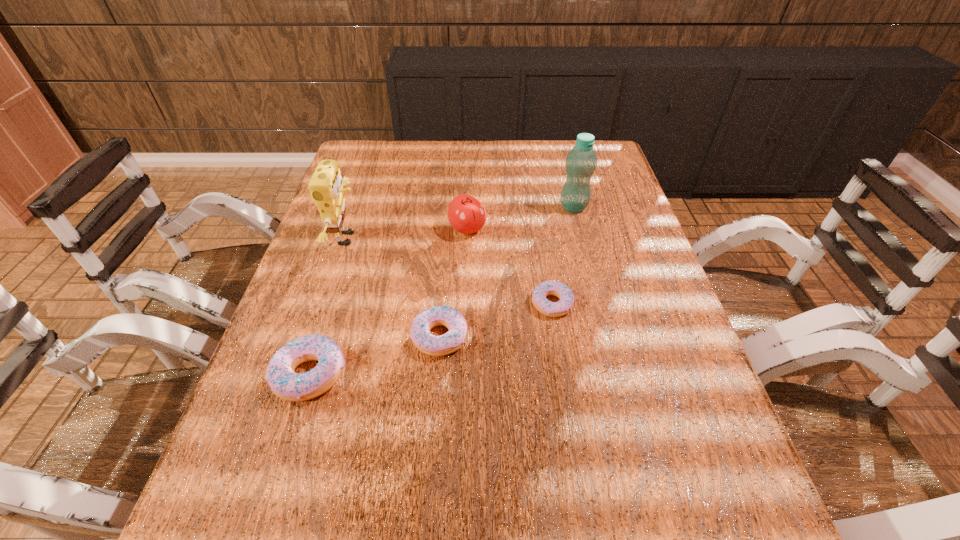
Image resolution: width=960 pixels, height=540 pixels. Identify the location of vacant space situated on the left of the fifth tallest object. (344, 337).

I want to click on free region located 0.300m on the left of the fifth object from left to right, so click(403, 304).

Locate an element on the screen. The width and height of the screenshot is (960, 540). free point located on the face of the sponge is located at coordinates (384, 239).

You are a GUI agent. You are given a task and a screenshot of the screen. Output one action in this format:
    pyautogui.click(x=<x>, y=<y>)
    Task: Click on the free region located at the front cap of the rightmost object
    The image size is (960, 540).
    Given the screenshot: What is the action you would take?
    pyautogui.click(x=581, y=236)

Locate an element on the screen. The height and width of the screenshot is (540, 960). free space located 0.140m on the front of the apple is located at coordinates (466, 279).

At what (x,y) coordinates should I click in order to perform the action: click on doughnut that is at the left edge. Please return your answer as a coordinate pair (x, y). Image resolution: width=960 pixels, height=540 pixels. Looking at the image, I should click on (280, 374).

Where is `sponge present at the left edge`? Image resolution: width=960 pixels, height=540 pixels. sponge present at the left edge is located at coordinates (326, 186).

You are a GUI agent. You are given a task and a screenshot of the screen. Output one action in this format:
    pyautogui.click(x=<x>, y=<y>)
    Task: Click on the object situated at the right edge
    The image size is (960, 540).
    Given the screenshot: What is the action you would take?
    pyautogui.click(x=581, y=161)

This screenshot has height=540, width=960. I want to click on free space at the far edge of the desktop, so click(524, 140).

Identify the location of vacant space at the near edge of the desktop. click(x=511, y=429).